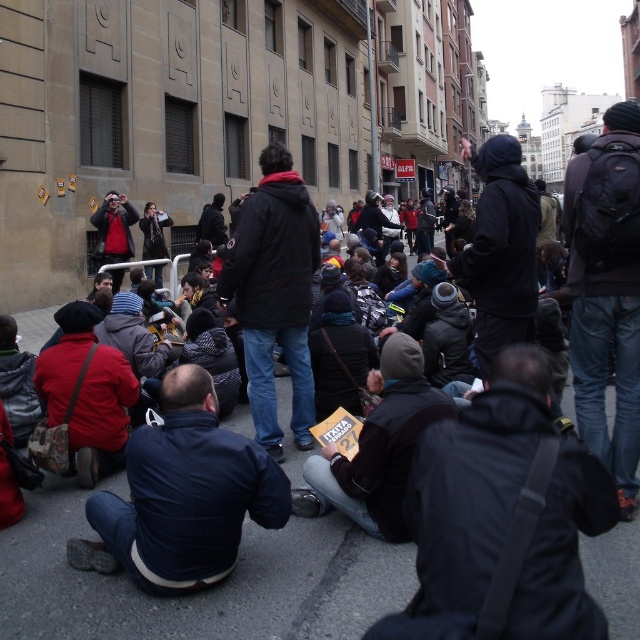
Does dark gray asphalt at center have a smaller size compared to black leather jacket at lower center?

Incorrect, dark gray asphalt at center is not smaller in size than black leather jacket at lower center.

Is dark gray asphalt at center taller than black leather jacket at lower center?

No, dark gray asphalt at center is not taller than black leather jacket at lower center.

Does point (310, 540) come closer to viewer compared to point (515, 570)?

No, it is not.

Where is `dark gray asphalt at center`? The height and width of the screenshot is (640, 640). dark gray asphalt at center is located at coordinates (205, 593).

Does dark gray asphalt at center have a lesser width compared to dark blue puffy jacket at lower left?

No.

Does dark gray asphalt at center appear on the left side of dark blue puffy jacket at lower left?

Incorrect, dark gray asphalt at center is not on the left side of dark blue puffy jacket at lower left.

The image size is (640, 640). What do you see at coordinates (205, 593) in the screenshot? I see `dark gray asphalt at center` at bounding box center [205, 593].

The image size is (640, 640). What are the coordinates of `dark gray asphalt at center` in the screenshot? It's located at (205, 593).

Is black leather jacket at lower center wider than dark blue puffy jacket at lower left?

No, black leather jacket at lower center is not wider than dark blue puffy jacket at lower left.

Does point (444, 605) come behind point (262, 492)?

No, (444, 605) is closer to viewer.

Consider the image. Who is more distant from viewer, [605,490] or [180,467]?

The point [180,467] is more distant.

Locate an element on the screen. The image size is (640, 640). black leather jacket at lower center is located at coordinates (502, 518).